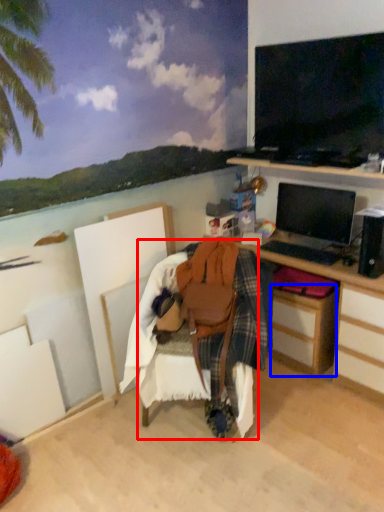
Question: Which object appears farthest to the camera in this image, chair (highlighted by a red box) or drawer (highlighted by a blue box)?

Choices:
 (A) chair
 (B) drawer

Answer: (B)